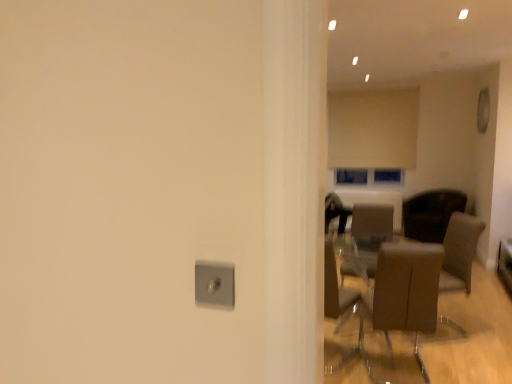
Question: Which direction should I rotate to look at brown leather chair at center, acting as the second chair starting from the front, — up or down?

Choices:
 (A) up
 (B) down

Answer: (B)

Question: From the image's perspective, would you say brown leather chair at center-right, which is the 3th chair from left to right, is shown under brown fabric armchair at right?

Choices:
 (A) no
 (B) yes

Answer: (A)

Question: Does brown leather chair at center-right, which appears as the first chair when viewed from the back, appear on the right side of brown fabric armchair at right?

Choices:
 (A) no
 (B) yes

Answer: (B)

Question: Is brown leather chair at center-right, which is the 3th chair from left to right, closer to camera compared to brown fabric armchair at right?

Choices:
 (A) no
 (B) yes

Answer: (A)

Question: Is brown leather chair at center-right, the third chair from the front, smaller than brown fabric armchair at right?

Choices:
 (A) no
 (B) yes

Answer: (A)

Question: From a real-world perspective, is brown leather chair at center-right, which is the 3th chair from left to right, on top of brown fabric armchair at right?

Choices:
 (A) yes
 (B) no

Answer: (A)

Question: Considering the relative positions of white textured radiator at center and beige fabric curtain at upper center in the image provided, is white textured radiator at center to the right of beige fabric curtain at upper center from the viewer's perspective?

Choices:
 (A) yes
 (B) no

Answer: (B)

Question: Is white textured radiator at center closer to the viewer compared to beige fabric curtain at upper center?

Choices:
 (A) no
 (B) yes

Answer: (A)

Question: Is white textured radiator at center taller than beige fabric curtain at upper center?

Choices:
 (A) yes
 (B) no

Answer: (B)

Question: Can you confirm if white textured radiator at center is thinner than beige fabric curtain at upper center?

Choices:
 (A) yes
 (B) no

Answer: (A)

Question: Is white textured radiator at center wider than beige fabric curtain at upper center?

Choices:
 (A) yes
 (B) no

Answer: (B)

Question: Is white textured radiator at center directly adjacent to beige fabric curtain at upper center?

Choices:
 (A) yes
 (B) no

Answer: (B)

Question: Considering the relative sizes of brown fabric armchair at right and brown leather chair at center-right, which is the 3th chair from left to right, in the image provided, is brown fabric armchair at right shorter than brown leather chair at center-right, which is the 3th chair from left to right,?

Choices:
 (A) no
 (B) yes

Answer: (A)